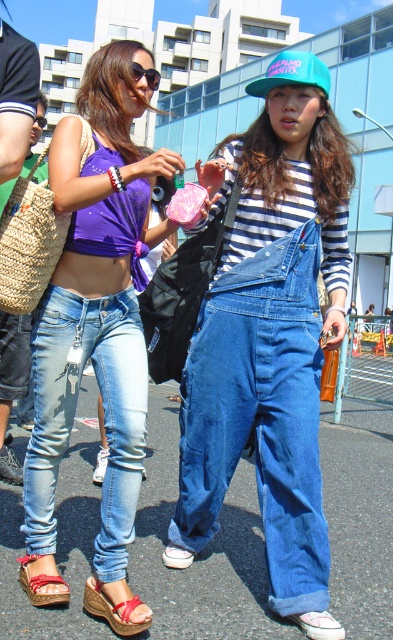
Question: Which point is closer to the camera?

Choices:
 (A) pink fabric sandal at lower center
 (B) denim at center
 (C) denim jeans at center
 (D) light blue denim jeans at lower left

Answer: (C)

Question: Can you confirm if light blue denim jeans at lower left is bigger than red leather wedge sandal at lower left?

Choices:
 (A) yes
 (B) no

Answer: (A)

Question: Estimate the real-world distances between objects in this image. Which object is farther from the denim at center?

Choices:
 (A) light blue denim jeans at lower left
 (B) teal matte baseball cap at center
 (C) denim jeans at center

Answer: (B)

Question: Where is red leather sandal at lower left located in relation to matte black sunglasses at upper center in the image?

Choices:
 (A) left
 (B) right

Answer: (A)

Question: Which of the following is the closest to the observer?

Choices:
 (A) light blue denim jeans at lower left
 (B) red leather sandal at lower left
 (C) red leather wedge sandal at lower left

Answer: (C)

Question: Is denim jeans at center to the right of teal matte baseball cap at center from the viewer's perspective?

Choices:
 (A) yes
 (B) no

Answer: (B)